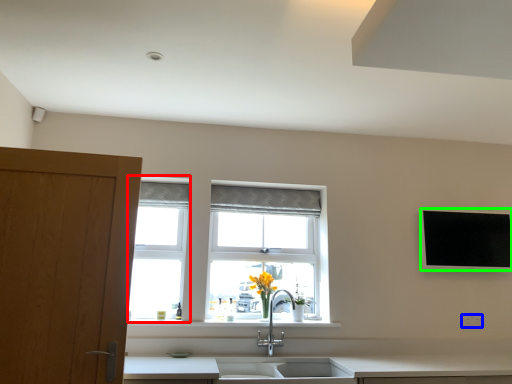
Question: Which object is the closest to the window frame (highlighted by a red box)? Choose among these: electric outlet (highlighted by a blue box) or flat (highlighted by a green box).

Choices:
 (A) electric outlet
 (B) flat

Answer: (B)